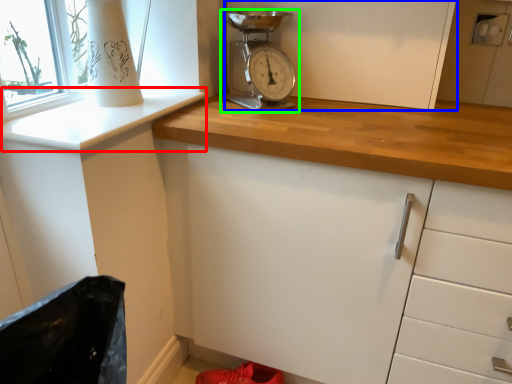
Question: Which object is positioned closest to window sill (highlighted by a red box)? Select from cabinetry (highlighted by a blue box) and home appliance (highlighted by a green box).

Choices:
 (A) cabinetry
 (B) home appliance

Answer: (B)